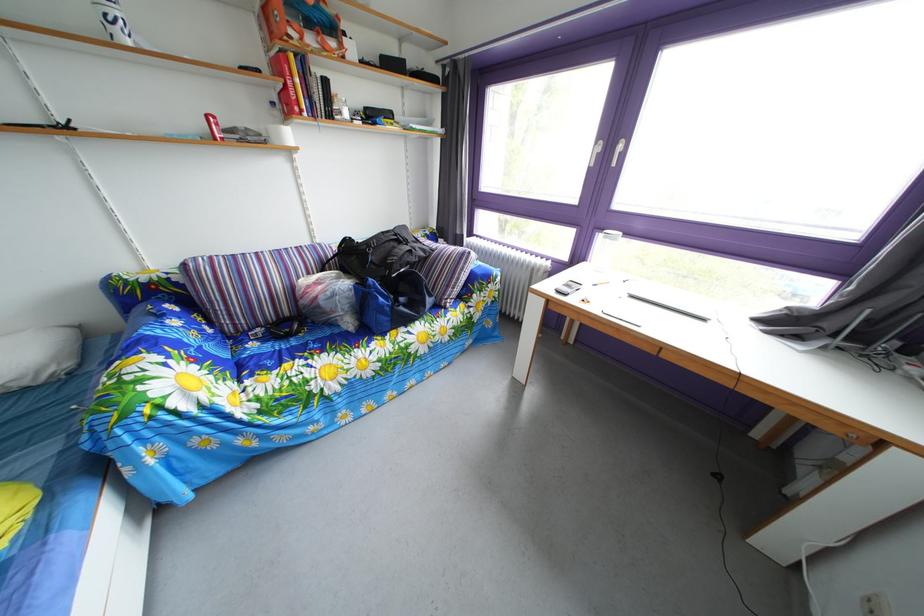
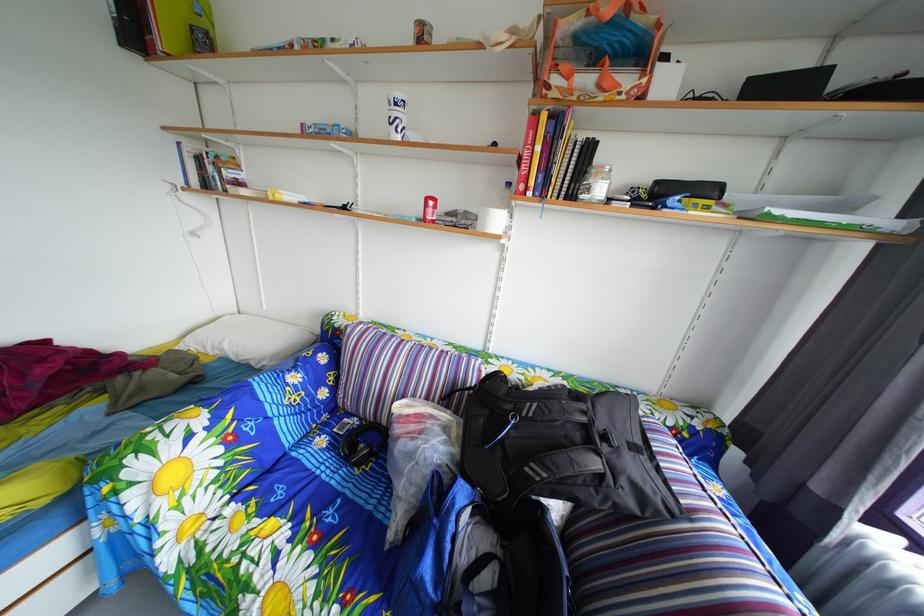
In the second image, find the point that corresponds to (x=446, y=257) in the first image.

(699, 523)